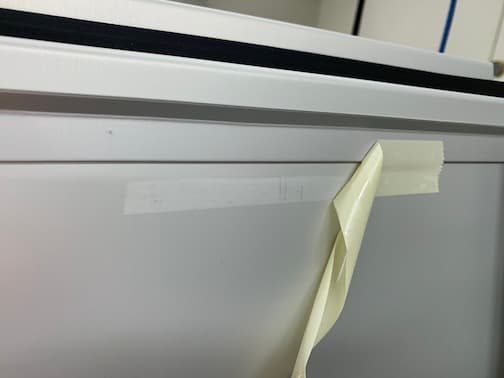
This screenshot has width=504, height=378. I want to click on flat surface, so click(x=260, y=247).